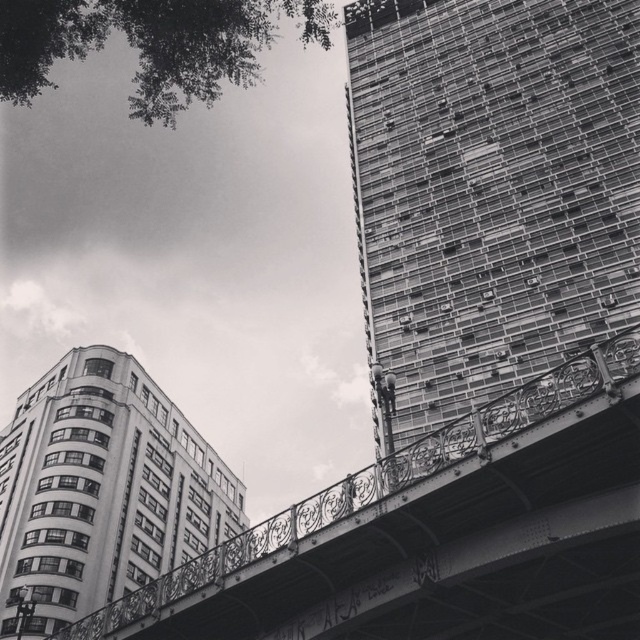
Question: Which point is closer to the camera?

Choices:
 (A) white glass building at lower left
 (B) metallic glass building at upper right

Answer: (B)

Question: Does metallic glass building at upper right appear over white glass building at lower left?

Choices:
 (A) yes
 (B) no

Answer: (A)

Question: Can you confirm if white glass building at lower left is smaller than metallic bridge at center?

Choices:
 (A) no
 (B) yes

Answer: (B)

Question: Which object is the farthest from the metallic bridge at center?

Choices:
 (A) white glass building at lower left
 (B) metallic glass building at upper right

Answer: (B)

Question: Can you confirm if white glass building at lower left is positioned to the left of metallic bridge at center?

Choices:
 (A) yes
 (B) no

Answer: (A)

Question: Which object appears farthest from the camera in this image?

Choices:
 (A) white glass building at lower left
 (B) metallic bridge at center

Answer: (A)